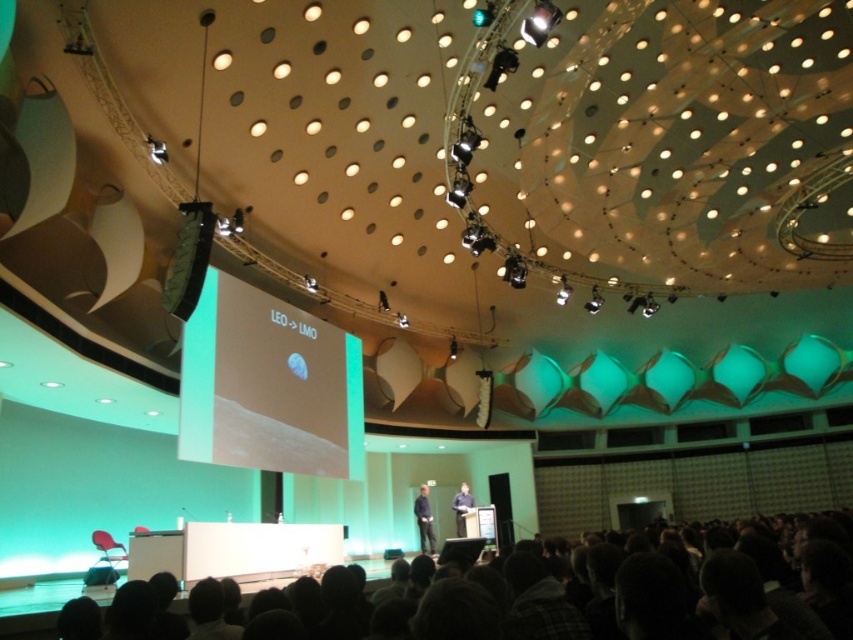
Between dark gray hair at lower center and dark blue fabric at center, which one is positioned lower?

dark blue fabric at center is lower down.

Can you confirm if dark gray hair at lower center is positioned to the left of dark blue fabric at center?

Incorrect, dark gray hair at lower center is not on the left side of dark blue fabric at center.

Find the location of a particular element. Image resolution: width=853 pixels, height=640 pixels. dark gray hair at lower center is located at coordinates (467, 618).

Which is below, green matte projection screen at center or dark blue fabric at center?

Positioned lower is dark blue fabric at center.

Describe the element at coordinates (268, 385) in the screenshot. I see `green matte projection screen at center` at that location.

The width and height of the screenshot is (853, 640). What are the coordinates of `green matte projection screen at center` in the screenshot? It's located at coord(268,385).

Who is positioned more to the left, dark gray hair at lower center or green matte projection screen at center?

green matte projection screen at center

Is point (347, 579) positioned behind point (230, 445)?

No, (347, 579) is closer to viewer.

From the picture: Who is more forward, [254,636] or [202,396]?

Positioned in front is point [254,636].

Where is `dark gray hair at lower center`? dark gray hair at lower center is located at coordinates (467, 618).